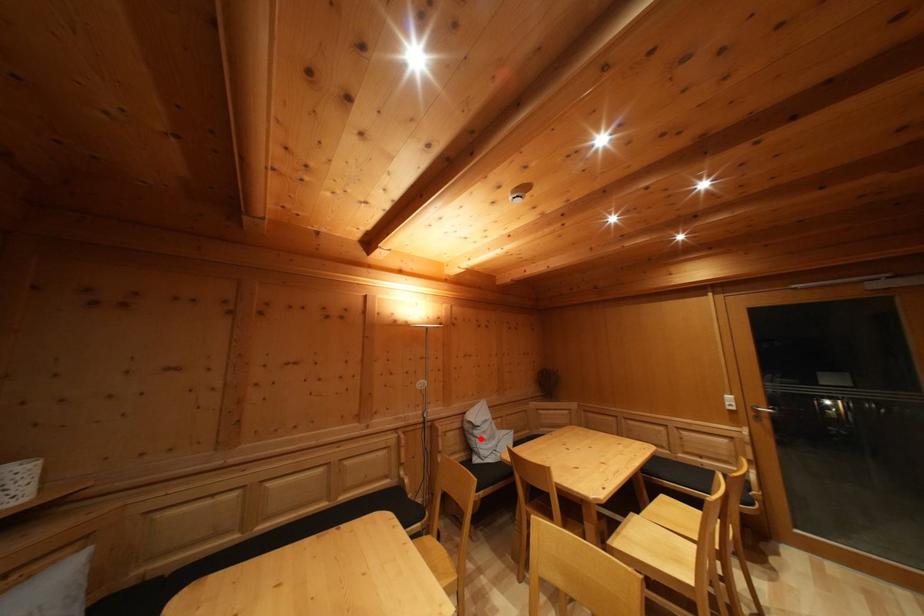
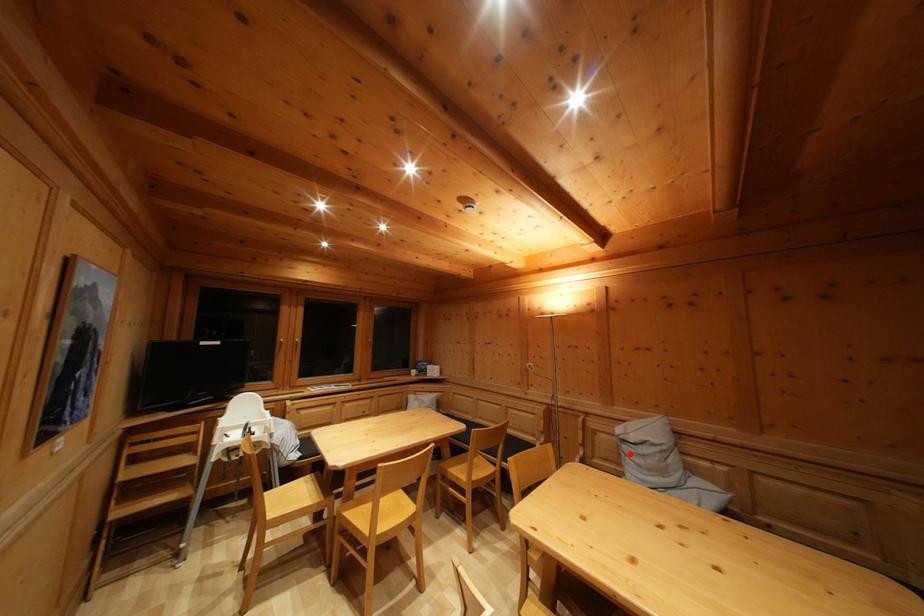
I am providing you with two images of the same scene from different viewpoints. A red point is marked on the first image and another point is marked on the second image. Do the highlighted points in image1 and image2 indicate the same real-world spot?

Yes